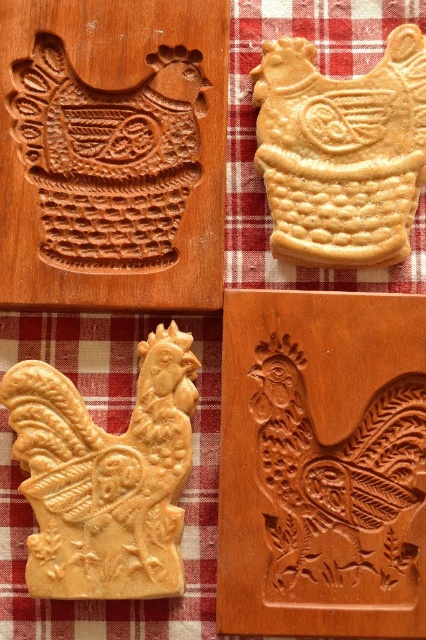
Question: Is wooden carving at center below light brown wood carving of chicken at center?

Choices:
 (A) no
 (B) yes

Answer: (A)

Question: Which point appears farthest from the camera in this image?

Choices:
 (A) (324, 493)
 (B) (85, 557)
 (C) (281, 74)

Answer: (C)

Question: Which point appears farthest from the camera in this image?

Choices:
 (A) (265, 406)
 (B) (71, 131)
 (C) (94, 461)
 (D) (293, 154)

Answer: (B)

Question: Which object is the closest to the golden-brown cookie at center-left?

Choices:
 (A) wooden carving at center
 (B) golden-brown cookie at upper center
 (C) light brown wood carving of chicken at center

Answer: (C)

Question: Does golden-brown cookie at center-left have a smaller size compared to golden-brown cookie at upper center?

Choices:
 (A) no
 (B) yes

Answer: (A)

Question: Is golden-brown cookie at center-left thinner than light brown wood carving of chicken at center?

Choices:
 (A) yes
 (B) no

Answer: (B)